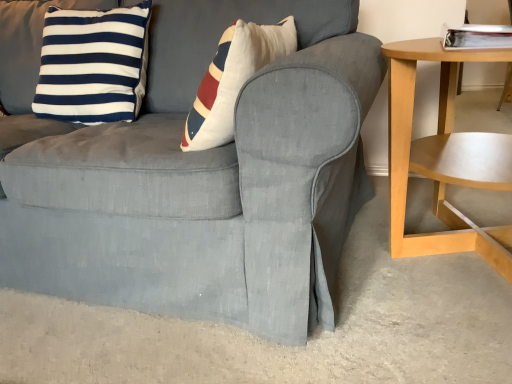
Question: Is navy blue/white striped cushion at upper left at the back of matte gray slipcover at center?

Choices:
 (A) no
 (B) yes

Answer: (B)

Question: Does matte gray slipcover at center have a smaller size compared to navy blue/white striped cushion at upper left?

Choices:
 (A) yes
 (B) no

Answer: (B)

Question: From the image's perspective, is matte gray slipcover at center on top of navy blue/white striped cushion at upper left?

Choices:
 (A) yes
 (B) no

Answer: (B)

Question: Can navy blue/white striped cushion at upper left be found inside matte gray slipcover at center?

Choices:
 (A) no
 (B) yes

Answer: (B)

Question: Is matte gray slipcover at center at the right side of navy blue/white striped cushion at upper left?

Choices:
 (A) no
 (B) yes

Answer: (A)

Question: Does matte gray slipcover at center have a greater width compared to navy blue/white striped cushion at upper left?

Choices:
 (A) no
 (B) yes

Answer: (B)

Question: Is matte gray slipcover at center to the right of light wood/woodenobject at right from the viewer's perspective?

Choices:
 (A) yes
 (B) no

Answer: (B)

Question: From the image's perspective, would you say matte gray slipcover at center is positioned over light wood/woodenobject at right?

Choices:
 (A) no
 (B) yes

Answer: (B)

Question: Would you consider matte gray slipcover at center to be distant from light wood/woodenobject at right?

Choices:
 (A) yes
 (B) no

Answer: (B)

Question: Does matte gray slipcover at center contain light wood/woodenobject at right?

Choices:
 (A) yes
 (B) no

Answer: (B)

Question: Is matte gray slipcover at center positioned in front of light wood/woodenobject at right?

Choices:
 (A) no
 (B) yes

Answer: (B)

Question: Can you confirm if matte gray slipcover at center is thinner than light wood/woodenobject at right?

Choices:
 (A) no
 (B) yes

Answer: (A)

Question: From a real-world perspective, is navy blue/white striped cushion at upper left located beneath light wood/woodenobject at right?

Choices:
 (A) no
 (B) yes

Answer: (A)